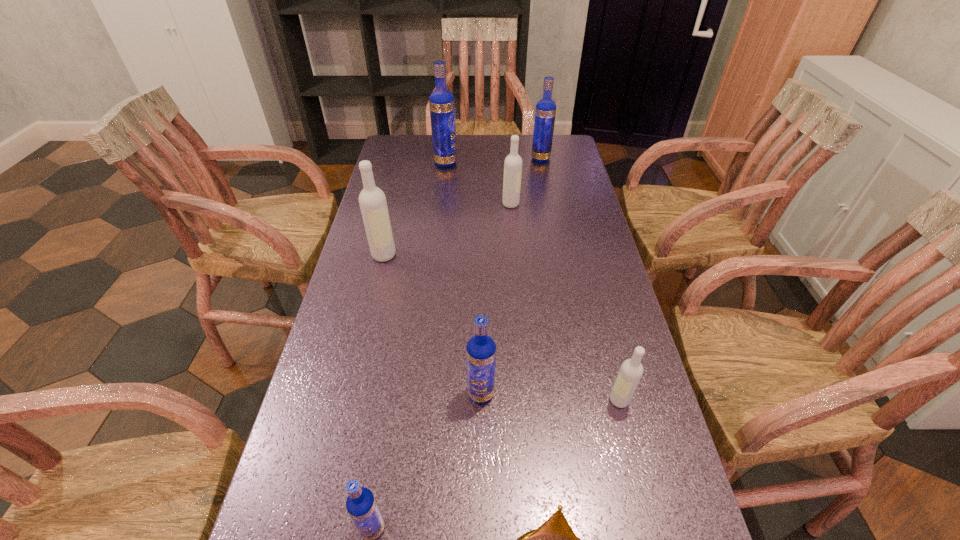
I want to click on the rightmost object, so click(x=630, y=373).

Where is `the rightmost vodka`? The height and width of the screenshot is (540, 960). the rightmost vodka is located at coordinates (630, 373).

This screenshot has width=960, height=540. In order to click on free region located on the front of the biggest blue vodka in this screenshot , I will do `click(442, 201)`.

Image resolution: width=960 pixels, height=540 pixels. I want to click on free space located on the front of the second vodka from right to left, so click(548, 197).

Image resolution: width=960 pixels, height=540 pixels. I want to click on free region located 0.160m on the front of the leftmost vodka, so click(372, 305).

Identify the location of vacant space located 0.200m on the right of the farthest white vodka. (580, 204).

Where is `vacant position located 0.130m on the front of the third farthest blue vodka`? vacant position located 0.130m on the front of the third farthest blue vodka is located at coordinates (481, 467).

Locate an element on the screen. The width and height of the screenshot is (960, 540). vacant area situated 0.160m on the front of the rightmost white vodka is located at coordinates (642, 489).

Find the location of a particular element. object situated at the left edge is located at coordinates (372, 200).

Image resolution: width=960 pixels, height=540 pixels. Find the location of `object present at the far right corner`. object present at the far right corner is located at coordinates (545, 112).